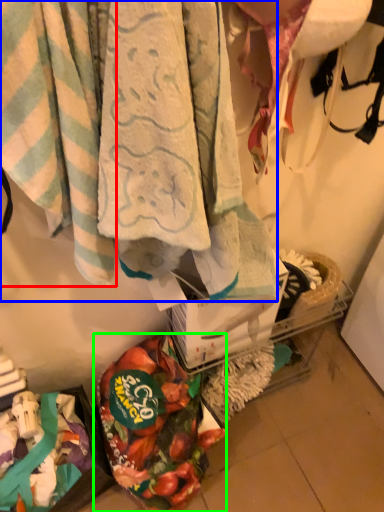
Question: Considering the real-world distances, which object is closest to towel (highlighted by a red box)? towel (highlighted by a blue box) or food (highlighted by a green box).

Choices:
 (A) towel
 (B) food

Answer: (A)